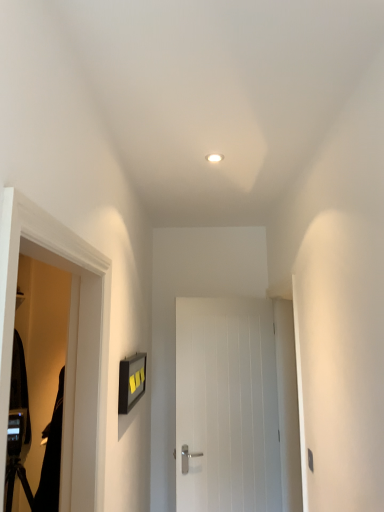
Question: Is black matte robe at left in front of or behind white wooden door at center in the image?

Choices:
 (A) behind
 (B) front

Answer: (B)

Question: From a real-world perspective, is black matte robe at left above or below white wooden door at center?

Choices:
 (A) below
 (B) above

Answer: (A)

Question: Which of these objects is positioned farthest from the white wooden door at center?

Choices:
 (A) white matte light fixture at upper center
 (B) black matte screen door at left
 (C) black matte robe at left

Answer: (A)

Question: Estimate the real-world distances between objects in this image. Which object is closer to the black matte robe at left?

Choices:
 (A) white wooden door at center
 (B) black matte screen door at left
 (C) white matte light fixture at upper center

Answer: (B)